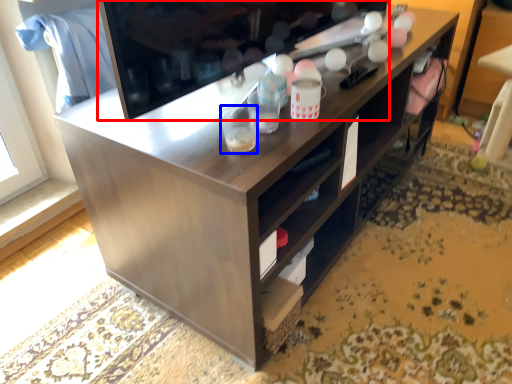
Question: Which of the following is the farthest to the observer, television (highlighted by a red box) or beverage (highlighted by a blue box)?

Choices:
 (A) television
 (B) beverage

Answer: (B)